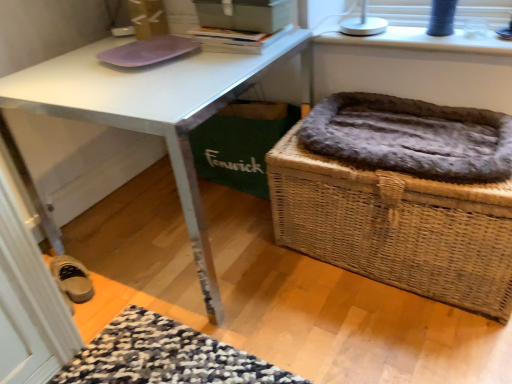
Find the location of a particular element. free space in front of fur-lined wicker basket at right is located at coordinates (397, 336).